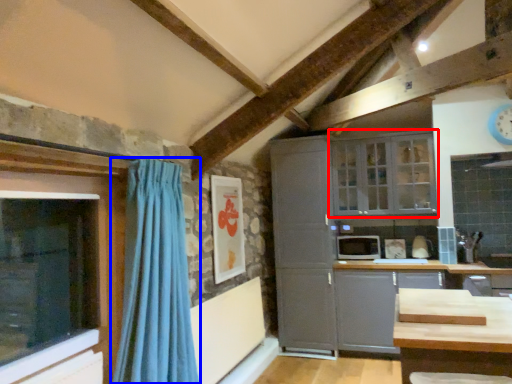
Question: Which point is further to the camera, window (highlighted by a red box) or curtain (highlighted by a blue box)?

Choices:
 (A) window
 (B) curtain

Answer: (A)